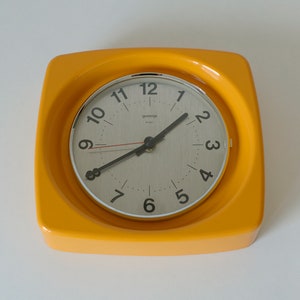
Find the location of a particular element. This screenshot has width=300, height=300. wall to the left of clock is located at coordinates (17, 145).